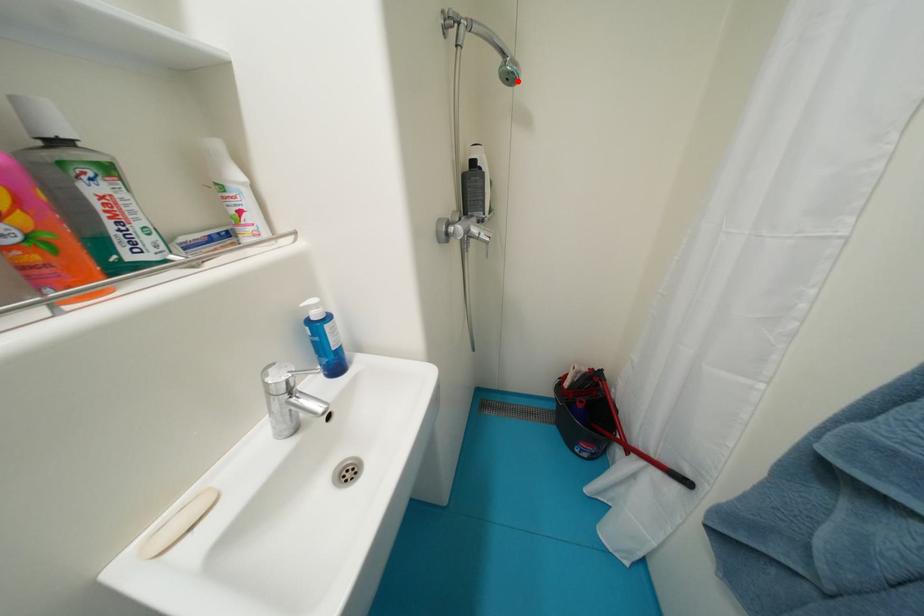
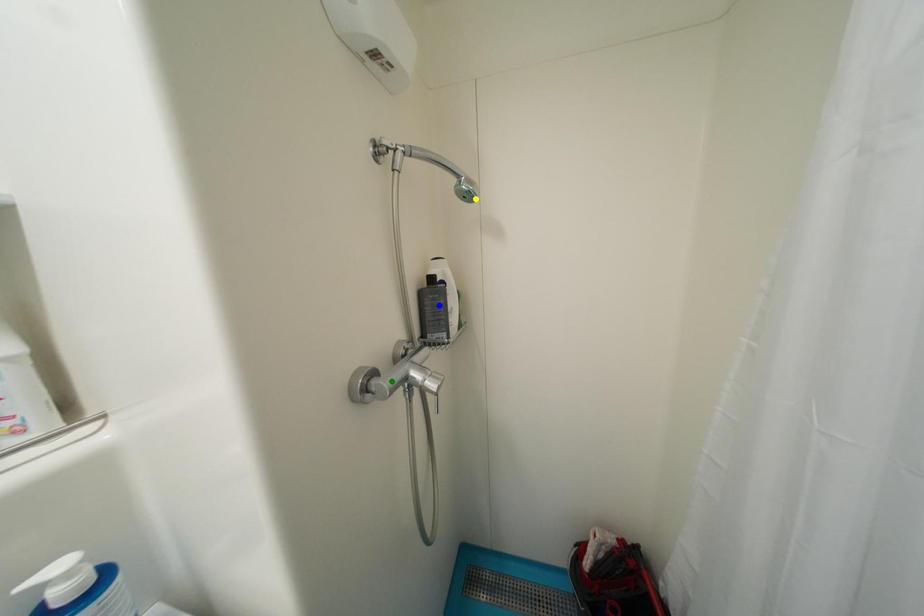
Question: I am providing you with two images of the same scene from different viewpoints. A red point is marked on the first image. You are given multiple points on the second image. Can you choose the point in image 2 that corresponds to the point in image 1?

Choices:
 (A) yellow point
 (B) green point
 (C) blue point

Answer: (A)